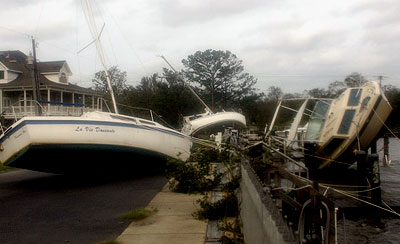
Where is `windows`? windows is located at coordinates (346, 121), (352, 101), (1, 75), (62, 76).